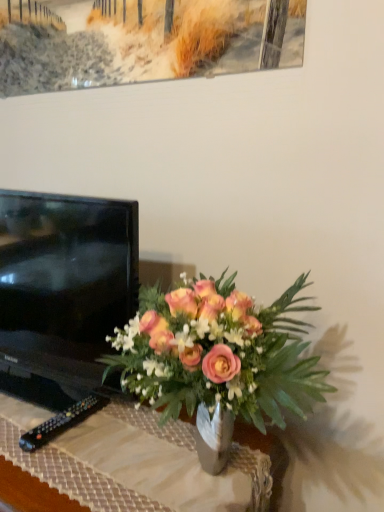
The image size is (384, 512). I want to click on vacant region in front of black plastic remote at lower left, so click(x=57, y=469).